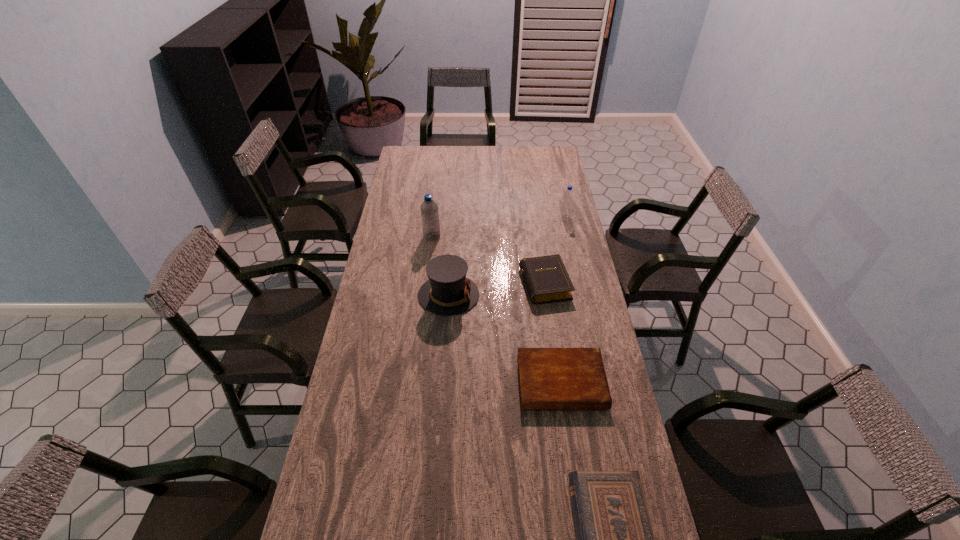
Locate an element on the screen. This screenshot has height=540, width=960. free region located 0.340m on the back of the farthest Bible is located at coordinates (535, 215).

At what (x,y) coordinates should I click in order to perform the action: click on free spot located on the spine side of the second farthest Bible. Please return your answer as a coordinate pair (x, y). This screenshot has height=540, width=960. Looking at the image, I should click on (570, 442).

The image size is (960, 540). In order to click on water bottle at the right edge in this screenshot , I will do `click(568, 195)`.

Locate an element on the screen. This screenshot has width=960, height=540. vacant space at the far edge of the desktop is located at coordinates (463, 165).

Find the location of a particular element. vacant area at the left edge of the desktop is located at coordinates coord(397,217).

Identify the location of vacant region at the right edge of the desktop. This screenshot has height=540, width=960. (550, 214).

Find the location of a particular element. free area in between the second farthest Bible and the farthest Bible is located at coordinates (553, 334).

In order to click on vacant area between the farthest Bible and the second farthest Bible in this screenshot , I will do `click(553, 334)`.

This screenshot has height=540, width=960. Find the location of `blank region between the farthest Bible and the fifth nearest object`. blank region between the farthest Bible and the fifth nearest object is located at coordinates (489, 261).

Where is `empty space that is in between the farthest Bible and the dress hat`? Image resolution: width=960 pixels, height=540 pixels. empty space that is in between the farthest Bible and the dress hat is located at coordinates (497, 290).